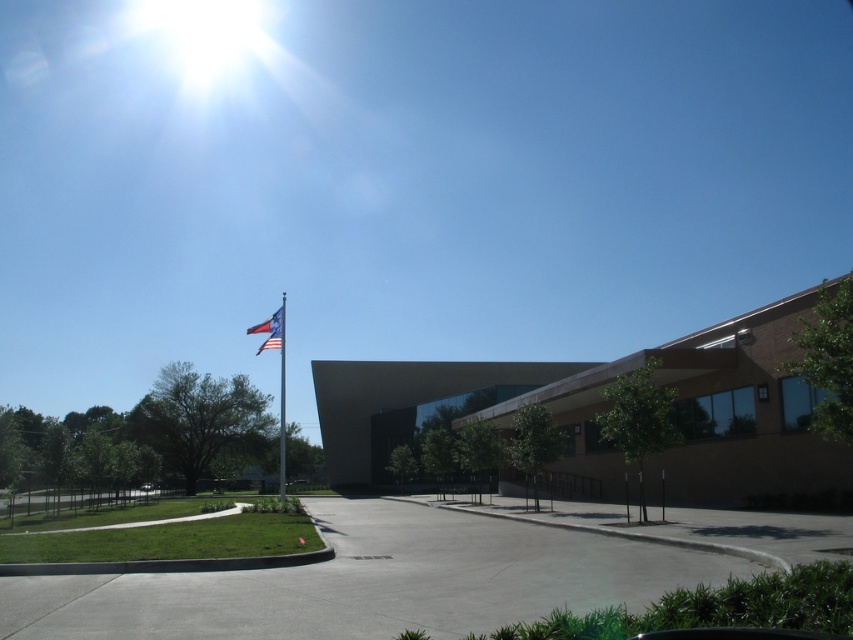
Question: Is polished metal flag pole at center thinner than american flag at upper left?

Choices:
 (A) yes
 (B) no

Answer: (A)

Question: Which point is farther to the camera?

Choices:
 (A) (273, 342)
 (B) (279, 484)

Answer: (B)

Question: Is polished metal flag pole at center smaller than american flag at upper left?

Choices:
 (A) no
 (B) yes

Answer: (A)

Question: Which point is closer to the camera?

Choices:
 (A) (257, 349)
 (B) (280, 419)

Answer: (B)

Question: Which of the following is the farthest from the observer?

Choices:
 (A) (282, 310)
 (B) (281, 460)

Answer: (A)

Question: Can you confirm if polished metal flag pole at center is positioned to the left of american flag at upper left?

Choices:
 (A) no
 (B) yes

Answer: (A)